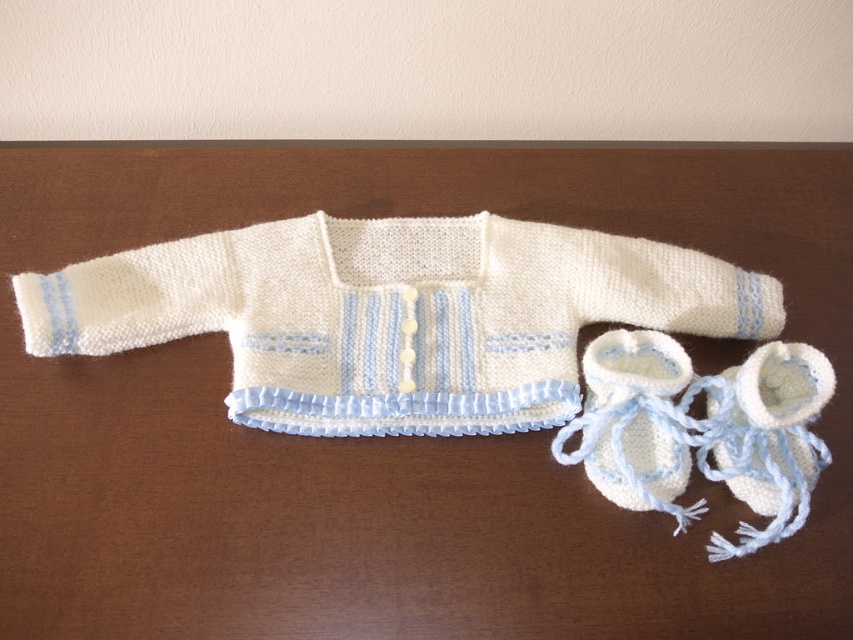
You are a parent who wants to place the white knitted bootie at lower right onto a shelf that is 1.1 meters away. Can you reach it without moving your position?

→ The white knitted bootie at lower right is 1.13 meters away from the viewer, which is slightly farther than the shelf distance of 1.1 meters. Therefore, you cannot reach it without moving closer.

You are organizing a baby shower and need to display the white knitted bootie at lower right and the white knitted booties at lower right on a shelf. Which one should you place higher to ensure they are arranged from top to bottom in the same order as they appear in the image?

The white knitted bootie at lower right should be placed below the white knitted booties at lower right to maintain the same vertical arrangement as in the image.